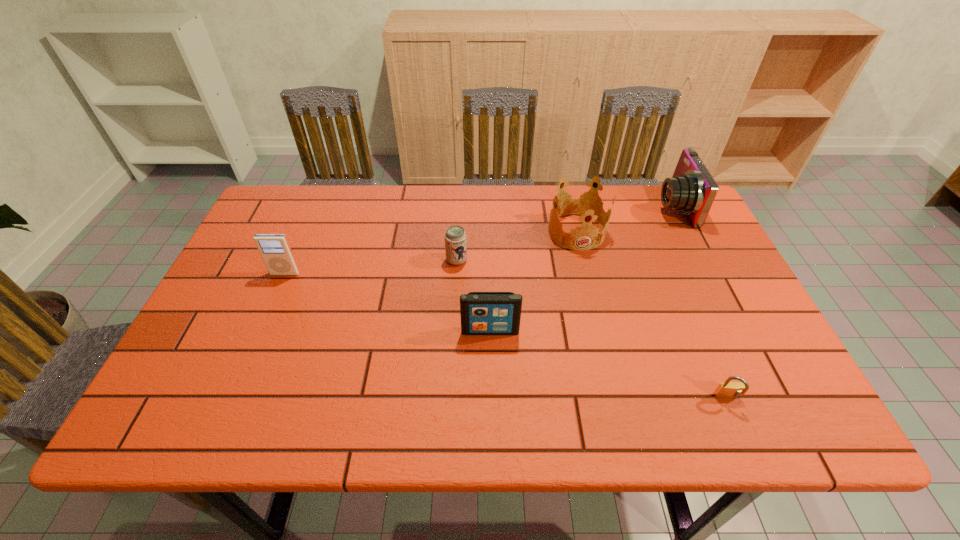
Image resolution: width=960 pixels, height=540 pixels. In order to click on free space at the near right corner of the desktop in this screenshot , I will do `click(779, 407)`.

Locate an element on the screen. This screenshot has width=960, height=540. free space that is in between the crown and the fourth nearest object is located at coordinates (516, 246).

Find the location of a particular element. This screenshot has width=960, height=540. vacant area that lies between the fifth tallest object and the fourth object from left to right is located at coordinates (516, 246).

Identify the location of free area in between the beer can and the shortest object. This screenshot has width=960, height=540. (591, 329).

Locate an element on the screen. The width and height of the screenshot is (960, 540). vacant area that lies between the padlock and the crown is located at coordinates (652, 315).

Where is `unoccupied position between the third object from right to left and the second nearest object`? unoccupied position between the third object from right to left and the second nearest object is located at coordinates (534, 281).

Where is `vacant space that is in between the fourth object from left to right and the leftmost object`? vacant space that is in between the fourth object from left to right and the leftmost object is located at coordinates (431, 252).

Locate an element on the screen. This screenshot has width=960, height=540. empty space between the nearer iPod and the camera is located at coordinates (582, 268).

The image size is (960, 540). In order to click on free point between the nearest object and the rightmost object in this screenshot , I will do `click(700, 302)`.

The image size is (960, 540). I want to click on unoccupied area between the fifth farthest object and the fourth object from left to right, so click(534, 281).